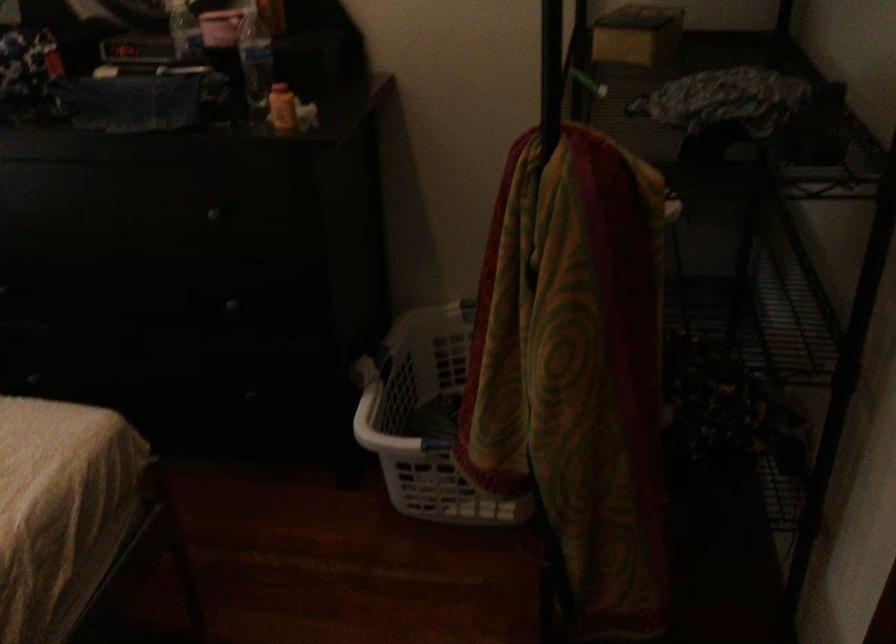
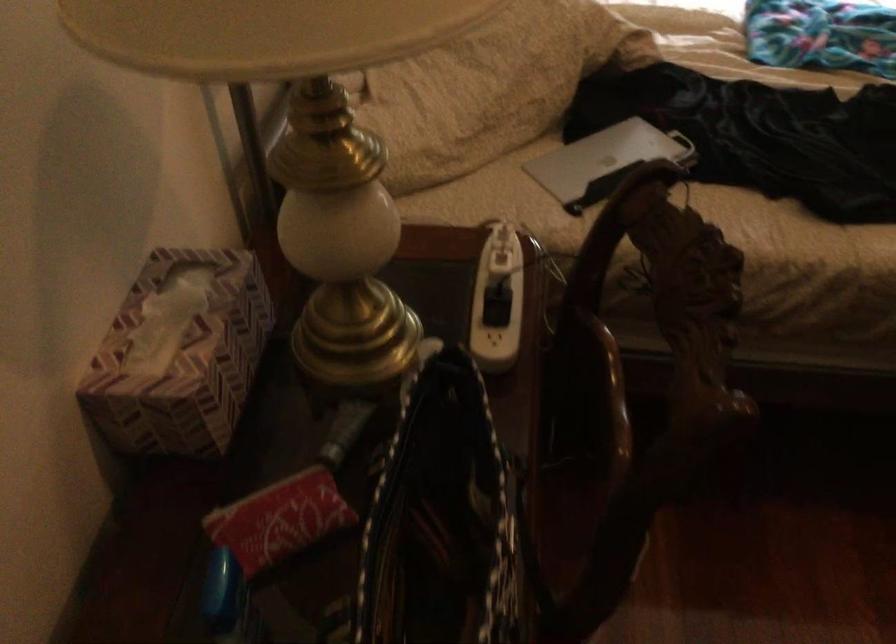
The images are taken continuously from a first-person perspective. In which direction is your viewpoint rotating?

The camera's rotation is toward left-down.